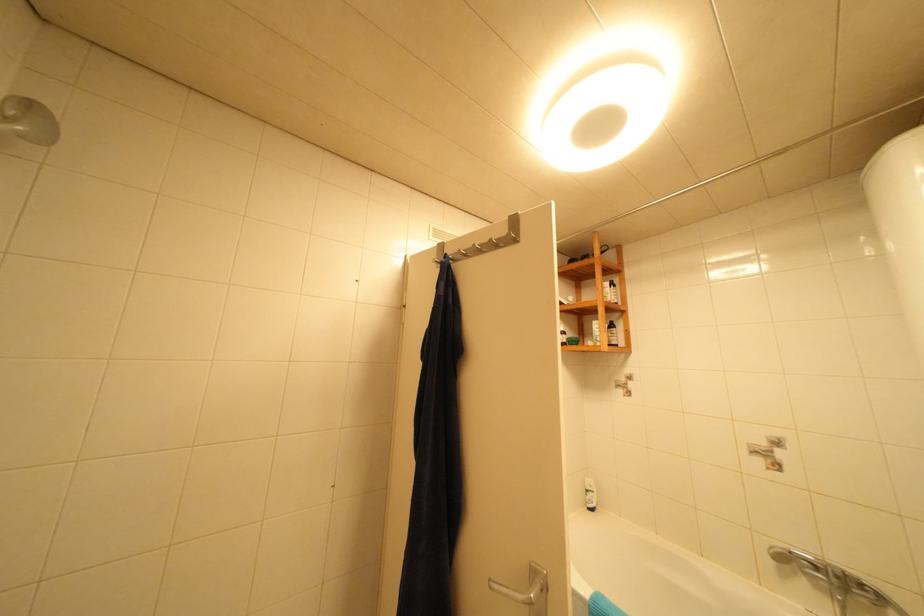
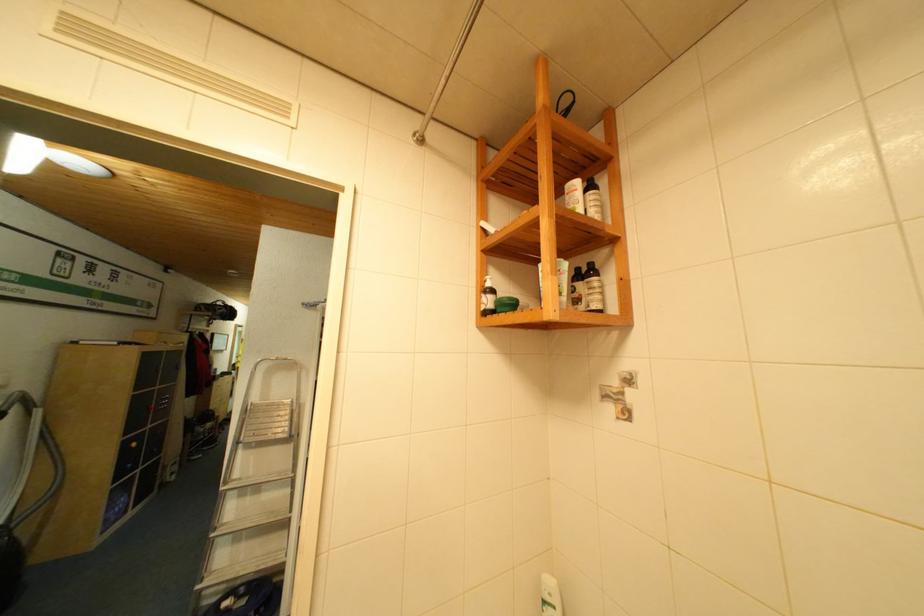
Based on the photo, what movement of the cameraman would produce the second image?

The cameraman moved toward right, forward.